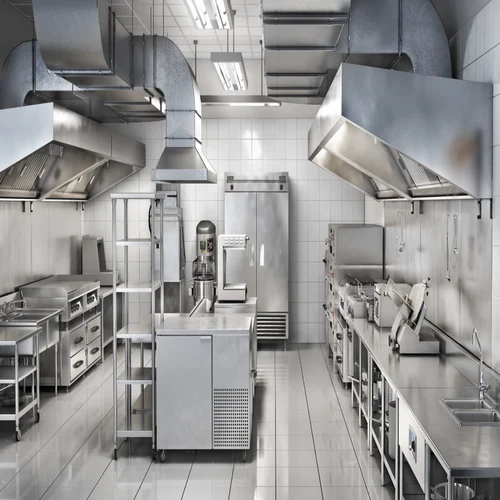
You are a GUI agent. You are given a task and a screenshot of the screen. Output one action in this format:
    pyautogui.click(x=<x>, y=<y>)
    Task: Click on the drawer
    Image resolution: width=500 pixels, height=500 pixels.
    Given the screenshot: What is the action you would take?
    pyautogui.click(x=94, y=333), pyautogui.click(x=80, y=336), pyautogui.click(x=78, y=365), pyautogui.click(x=103, y=360)